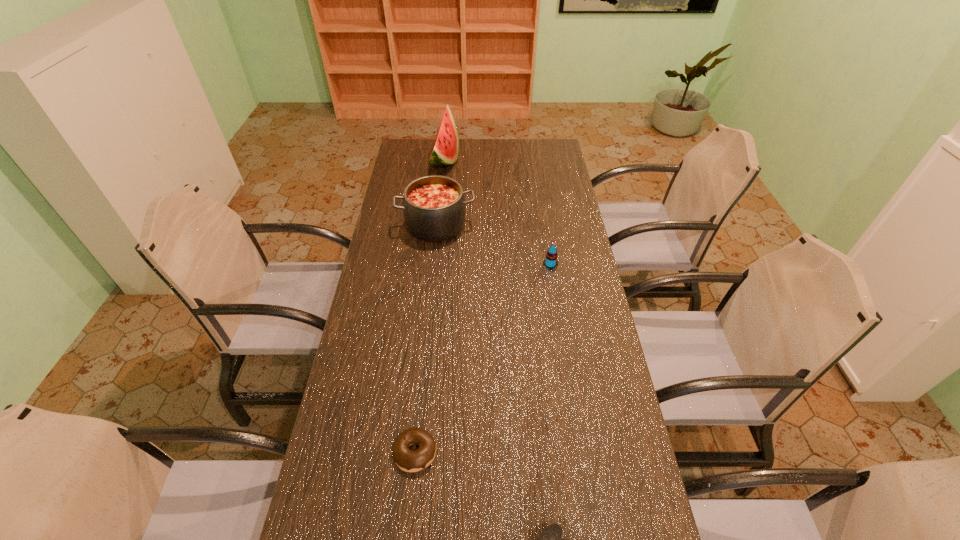
Find the location of a particular element. The image size is (960, 540). vacant space located on the front of the third farthest object is located at coordinates (554, 284).

Locate an element on the screen. The width and height of the screenshot is (960, 540). free location located on the right of the shortest object is located at coordinates (476, 452).

Where is `object that is at the far edge`? object that is at the far edge is located at coordinates (445, 151).

Image resolution: width=960 pixels, height=540 pixels. What are the coordinates of `watermelon situated at the left edge` in the screenshot? It's located at (445, 151).

Identify the location of casserole that is at the left edge. The width and height of the screenshot is (960, 540). (434, 206).

Identify the location of object that is at the right edge. (551, 261).

I want to click on object that is at the far left corner, so (x=445, y=151).

Where is `free spot at the far edge of the desktop`? The image size is (960, 540). free spot at the far edge of the desktop is located at coordinates (506, 156).

Image resolution: width=960 pixels, height=540 pixels. In order to click on free location at the left edge in this screenshot , I will do `click(376, 418)`.

Image resolution: width=960 pixels, height=540 pixels. I want to click on vacant area at the right edge, so click(570, 353).